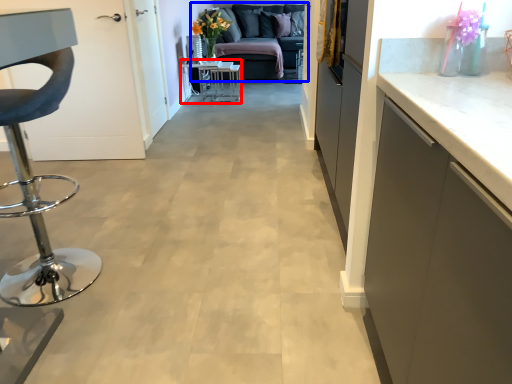
Question: Which of the following is the closest to the observer, table (highlighted by a red box) or studio couch (highlighted by a blue box)?

Choices:
 (A) table
 (B) studio couch

Answer: (A)